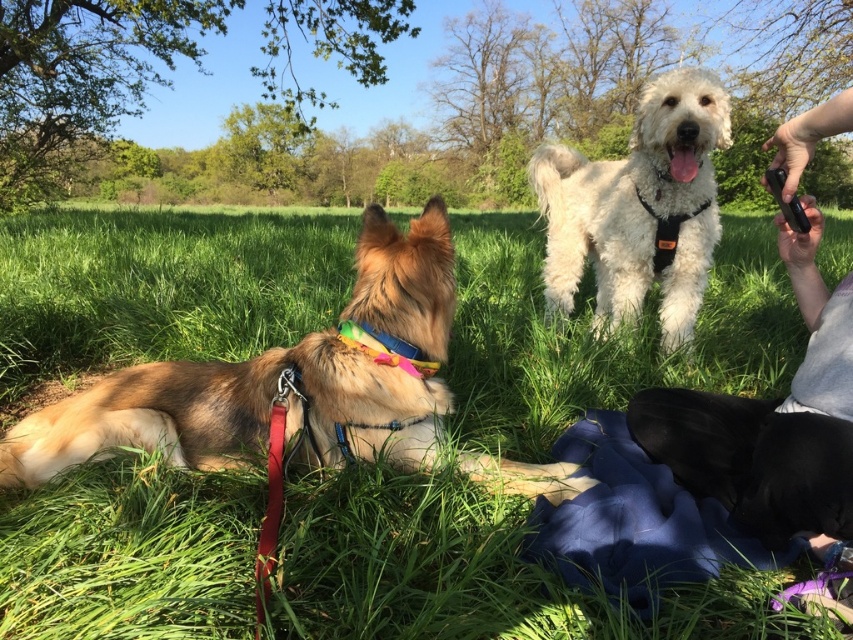
You are a dog trainer who needs to separate two dogs in a field. The golden fur dog at left and the white fluffy dog at upper center are currently 5.92 feet apart. Your tool can only reach up to 5 feet. Can your tool reach both dogs at the same time?

The distance between the golden fur dog at left and the white fluffy dog at upper center is 5.92 feet, which is greater than the tool reach of 5 feet. Therefore, the tool cannot reach both dogs simultaneously.

You are a photographer standing in the field. You see the green grass at center and the white fluffy dog at upper center. Which object is closer to you?

The green grass at center is positioned over the white fluffy dog at upper center, meaning it is closer to you.